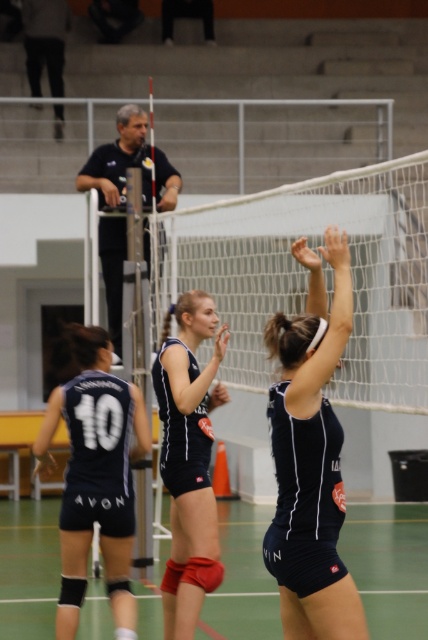
Question: Does matte black volleyball net at center appear under matte blue uniform at center?

Choices:
 (A) yes
 (B) no

Answer: (B)

Question: Which object is positioned farthest from the matte black shorts at center?

Choices:
 (A) matte blue uniform at center
 (B) white mesh net at center

Answer: (A)

Question: Is matte black shorts at center above dark blue shirt at upper left?

Choices:
 (A) no
 (B) yes

Answer: (A)

Question: Does matte blue jersey at center have a greater width compared to matte blue uniform at center?

Choices:
 (A) no
 (B) yes

Answer: (B)

Question: Which of these objects is positioned closest to the white mesh net at center?

Choices:
 (A) matte black shorts at center
 (B) matte black volleyball net at center
 (C) matte blue uniform at center

Answer: (A)

Question: Which object appears closest to the camera in this image?

Choices:
 (A) white mesh net at center
 (B) matte blue jersey at center

Answer: (B)